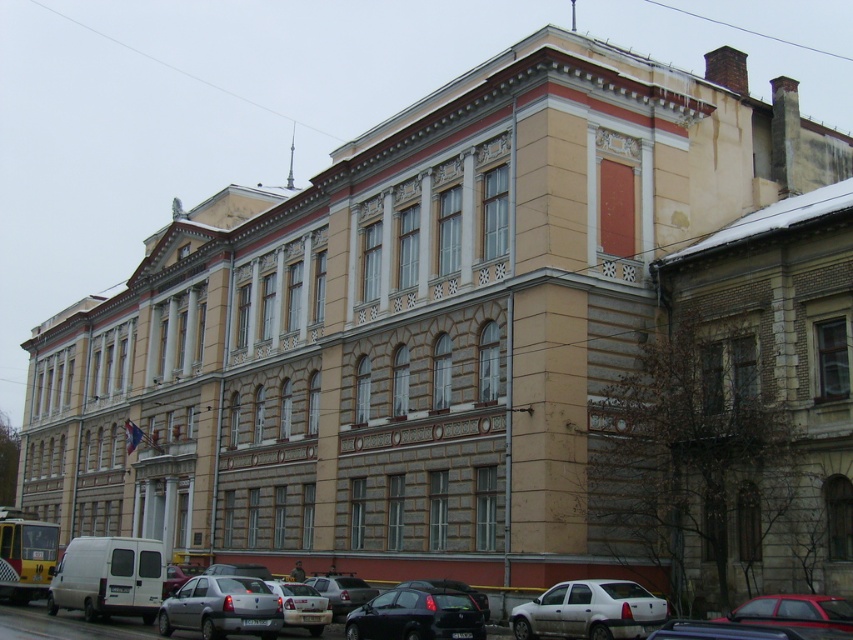
You are a delivery person trying to park a van that is 6 meters long. You see the white matte sedan at lower right and the silver metallic sedan at lower center in the parking lot. Which vehicle should you choose to park next to if you need space for your van?

The white matte sedan at lower right is larger in size than the silver metallic sedan at lower center, so you should park next to the silver metallic sedan at lower center because it takes up less space, allowing more room for your van.

Looking at this image, you are standing in front of the large classical building and looking at the two points marked on its facade. Which point is closer to you, point 1 at coordinates point (538,616) or point 2 at coordinates point (751,604)?

Point 1 at coordinates point (538,616) is closer to you because it is further to the camera than point 2 at coordinates point (751,604).